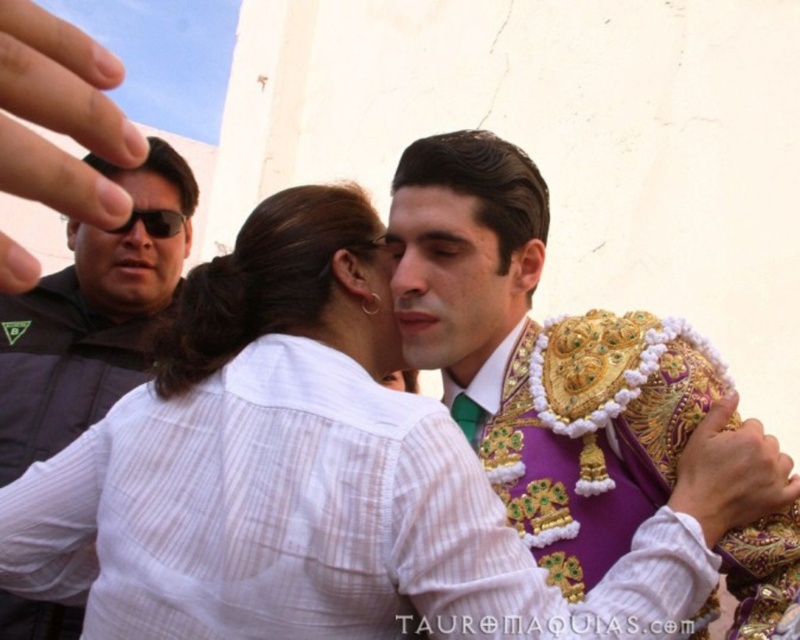
Which is more to the right, purple velvet vest at center or black matte jacket at left?

purple velvet vest at center

The width and height of the screenshot is (800, 640). In order to click on purple velvet vest at center in this screenshot , I will do `click(528, 356)`.